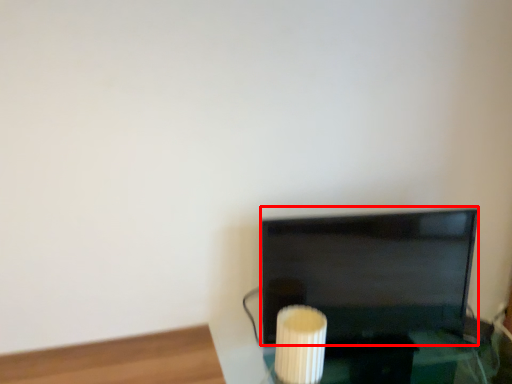
Question: In this image, where is television (annotated by the red box) located relative to candle holder?

Choices:
 (A) left
 (B) right

Answer: (B)